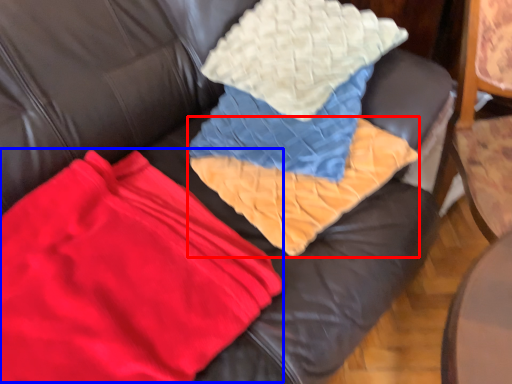
Question: Which of the following is the farthest to the observer, blanket (highlighted by a red box) or fabric (highlighted by a blue box)?

Choices:
 (A) blanket
 (B) fabric

Answer: (A)